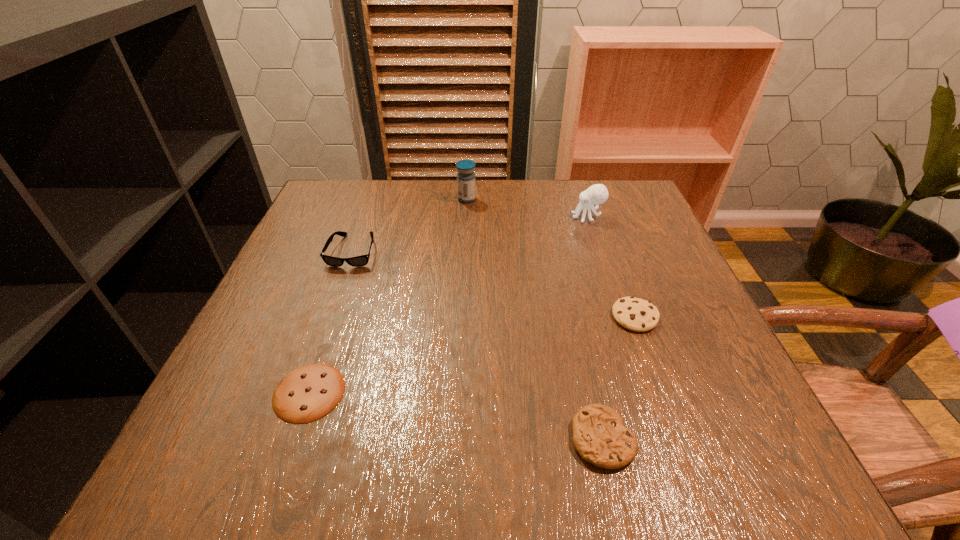
Find the location of a particular element. free location located on the front-facing side of the fifth nearest object is located at coordinates (520, 217).

At what (x,y) coordinates should I click in order to perform the action: click on free space located 0.170m on the front-facing side of the fifth nearest object. Please return your answer as a coordinate pair (x, y). The width and height of the screenshot is (960, 540). Looking at the image, I should click on (504, 217).

Find the location of a particular element. free space located 0.130m on the front-facing side of the fifth nearest object is located at coordinates (520, 217).

The width and height of the screenshot is (960, 540). What are the coordinates of `vacant region located on the front-facing side of the fourth nearest object` in the screenshot? It's located at (325, 328).

Where is `free region located on the right of the farthest cookie`? This screenshot has width=960, height=540. free region located on the right of the farthest cookie is located at coordinates (700, 316).

At what (x,y) coordinates should I click in order to perform the action: click on free region located 0.220m on the left of the third object from right to left. Please return your answer as a coordinate pair (x, y). The width and height of the screenshot is (960, 540). Looking at the image, I should click on (423, 438).

Locate an element on the screen. This screenshot has height=540, width=960. vacant space situated 0.050m on the left of the shortest object is located at coordinates (244, 392).

The width and height of the screenshot is (960, 540). Find the location of `medicine that is positioned at the far edge`. medicine that is positioned at the far edge is located at coordinates (465, 177).

Locate an element on the screen. The width and height of the screenshot is (960, 540). octopus located at the far edge is located at coordinates coord(596,194).

Locate an element on the screen. sunglasses located in the left edge section of the desktop is located at coordinates (358, 261).